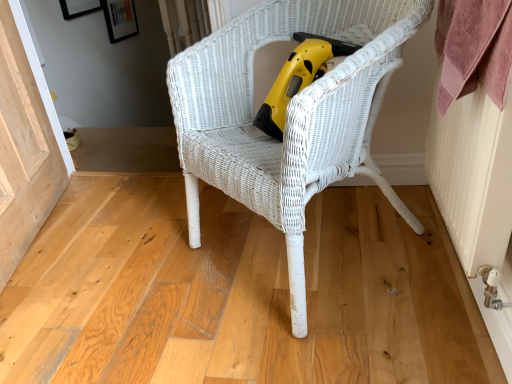
Locate an element on the screen. The width and height of the screenshot is (512, 384). vacant space to the right of natural wood screen door at lower left is located at coordinates (116, 238).